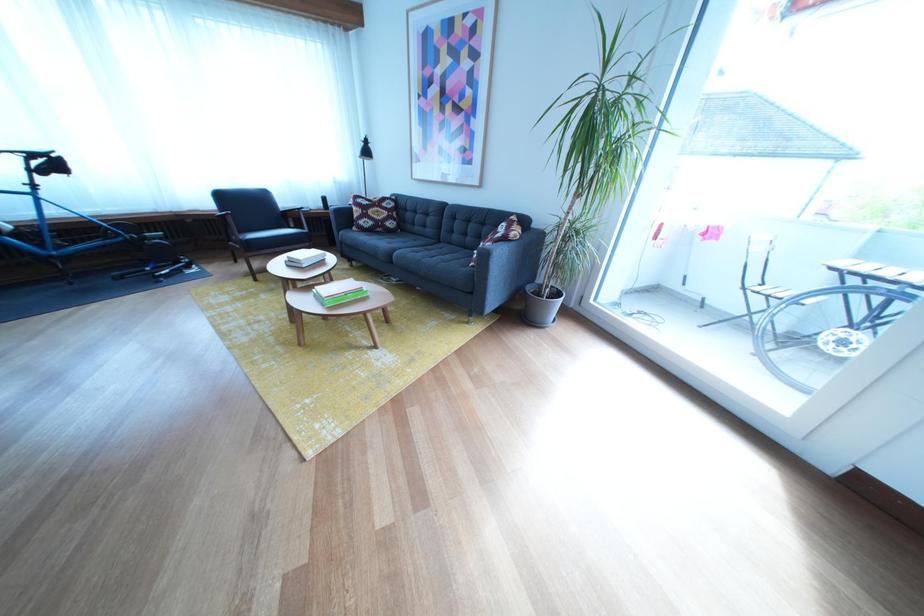
Locate an element on the screen. This screenshot has width=924, height=616. white book is located at coordinates (305, 257).